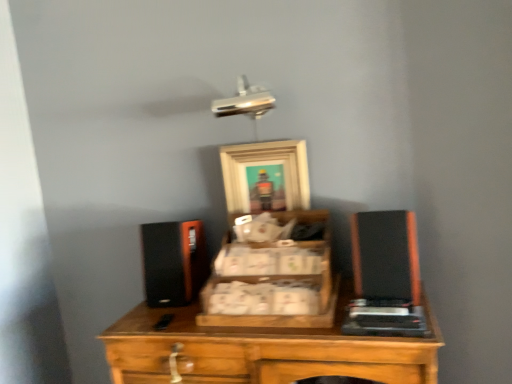
Question: In the image, is wooden crate at center positioned in front of or behind black matte speaker at right?

Choices:
 (A) behind
 (B) front

Answer: (B)

Question: Considering the positions of wooden crate at center and black matte speaker at right in the image, is wooden crate at center taller or shorter than black matte speaker at right?

Choices:
 (A) short
 (B) tall

Answer: (A)

Question: Estimate the real-world distances between objects in this image. Which object is farther from the wooden crate at center?

Choices:
 (A) wooden picture frame at center
 (B) black matte speaker at right

Answer: (A)

Question: Which object is the farthest from the wooden crate at center?

Choices:
 (A) wooden picture frame at center
 (B) black matte speaker at right

Answer: (A)